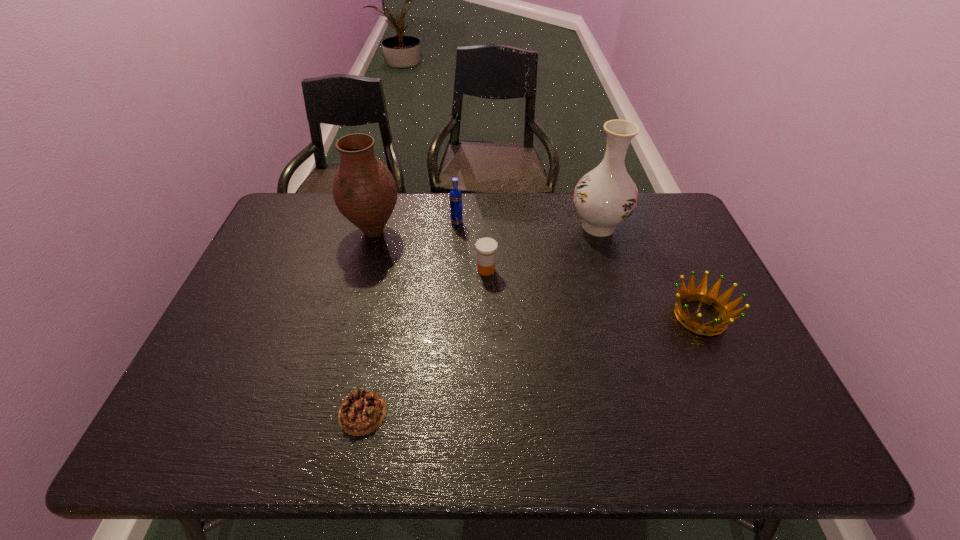
Find the location of a particular element. blank space located 0.130m on the right of the fifth object from left to right is located at coordinates (668, 226).

What are the coordinates of `free spot located 0.140m on the left of the left vase` in the screenshot? It's located at (301, 232).

Image resolution: width=960 pixels, height=540 pixels. What are the coordinates of `free space located on the front of the vodka` in the screenshot? It's located at (x=452, y=298).

Identify the location of free space located on the label of the third nearest object. This screenshot has height=540, width=960. (487, 314).

Find the location of a particular element. The width and height of the screenshot is (960, 540). free space located 0.200m on the front of the fifth farthest object is located at coordinates (746, 416).

Find the location of a particular element. free location located 0.110m on the left of the nearest object is located at coordinates (289, 413).

Where is `vodka that is at the far edge`? This screenshot has width=960, height=540. vodka that is at the far edge is located at coordinates (456, 212).

At what (x,y) coordinates should I click in order to perform the action: click on object present at the near edge. Please return your answer as a coordinate pair (x, y). Image resolution: width=960 pixels, height=540 pixels. Looking at the image, I should click on (362, 411).

At what (x,y) coordinates should I click in order to perform the action: click on object located in the right edge section of the desktop. Please return your answer as a coordinate pair (x, y). Looking at the image, I should click on (710, 297).

Identify the location of vacant region at the far edge. (406, 211).